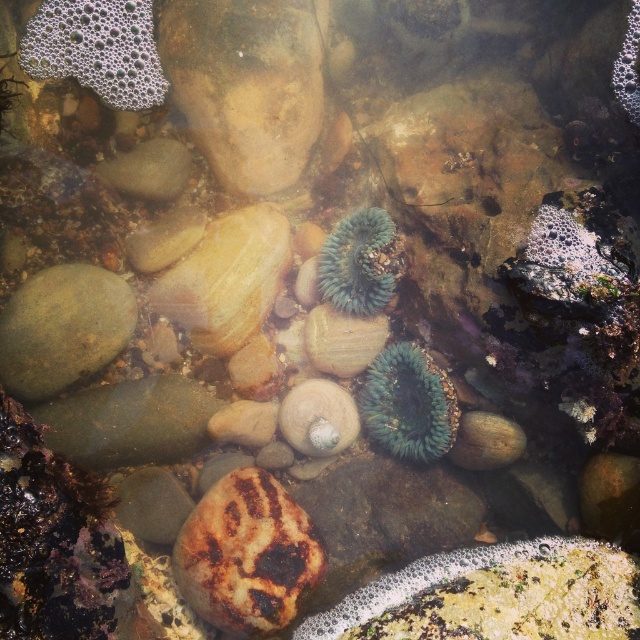
What are the coordinates of the green fuzzy anemone at center?

The green fuzzy anemone at center is located at coordinates point (408,403).

You are a diver looking at the underwater scene. You see two points marked in the image. Which point is closer to you, point [371,397] or point [339,260]?

Point [371,397] is closer to the viewer than point [339,260].

You are a marine biologist observing an underwater scene from a boat anchored 3 meters above the seabed. You notice a point marked at coordinates point (x=307, y=577). Can you safely reach this point with a 3.5 meter long sampling tool without exceeding your current depth?

The distance between point (x=307, y=577) and the camera is 2.24 meters. Since the boat is anchored 3 meters above the seabed, the total depth from the boat to the point is 3 meters minus the distance from the camera to the point. Wait, actually, the camera is at the boat level, so the tool needs to reach down 3 meters minus the 2.24 meters? Hmm, maybe I need to clarify. The camera is 3 meters above the seabed, and the point is 2.24 meters away from the camera. So the tool only needs to extend 2.24 meters to